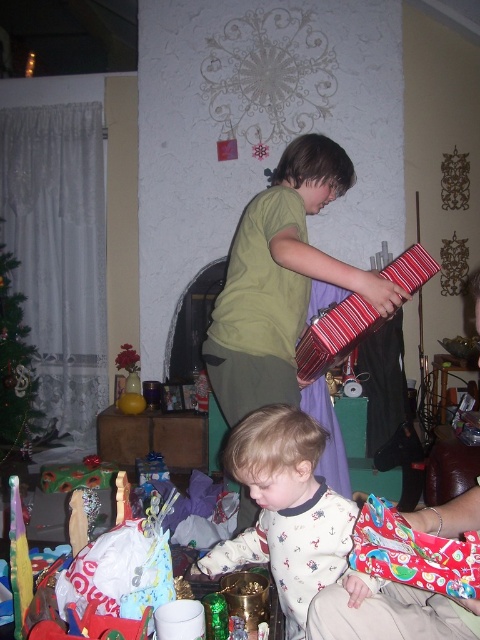
Which is below, white soft pajamas at lower center or green matte christmas tree at left?

white soft pajamas at lower center

Is white soft pajamas at lower center smaller than green matte christmas tree at left?

Indeed, white soft pajamas at lower center has a smaller size compared to green matte christmas tree at left.

The image size is (480, 640). What do you see at coordinates (286, 509) in the screenshot?
I see `white soft pajamas at lower center` at bounding box center [286, 509].

This screenshot has width=480, height=640. Find the location of `white soft pajamas at lower center`. white soft pajamas at lower center is located at coordinates (286, 509).

Can you confirm if white soft pajamas at lower center is positioned below matte red suitcase at center?

No.

Measure the distance between white soft pajamas at lower center and matte red suitcase at center.

white soft pajamas at lower center is 11.93 inches from matte red suitcase at center.

Describe the element at coordinates (286, 509) in the screenshot. I see `white soft pajamas at lower center` at that location.

Find the location of a particular element. This screenshot has width=480, height=640. white soft pajamas at lower center is located at coordinates (286, 509).

From the picture: How distant is printed fabric wrapped gift at lower right from matte red suitcase at center?

The distance of printed fabric wrapped gift at lower right from matte red suitcase at center is 5.43 centimeters.

Does printed fabric wrapped gift at lower right appear on the right side of matte red suitcase at center?

Incorrect, printed fabric wrapped gift at lower right is not on the right side of matte red suitcase at center.

Is point (355, 564) less distant than point (448, 524)?

Yes.

Identify the location of printed fabric wrapped gift at lower right. The height and width of the screenshot is (640, 480). (415, 552).